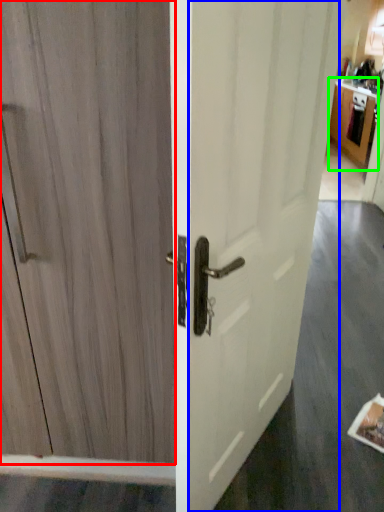
Question: Based on their relative distances, which object is farther from door (highlighted by a red box)? Choose from screen door (highlighted by a blue box) and cabinetry (highlighted by a green box).

Choices:
 (A) screen door
 (B) cabinetry

Answer: (B)